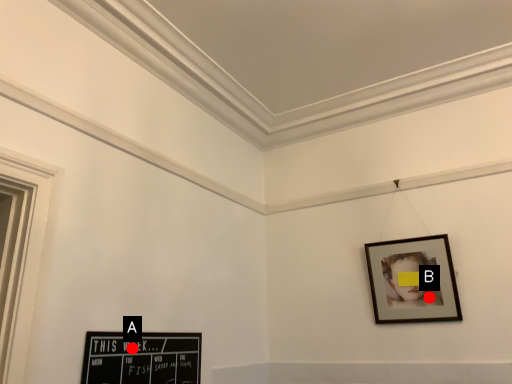
Question: Two points are circled on the image, labeled by A and B beside each circle. Which point is farther from the camera taking this photo?

Choices:
 (A) A is further
 (B) B is further

Answer: (B)